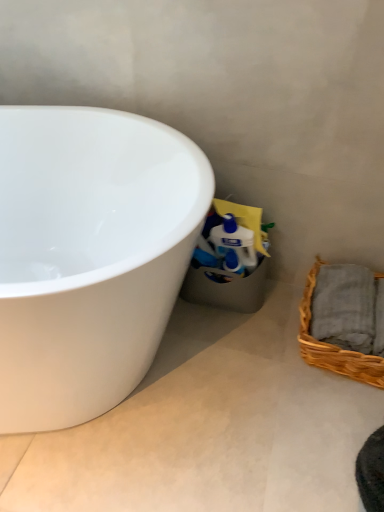
What is the approximate width of white glossy concrete at lower left?

It is 38.07 inches.

What is the approximate width of woven brown picnic basket at lower right?

11.73 inches.

The width and height of the screenshot is (384, 512). In order to click on white glossy bathtub at left in this screenshot , I will do `click(89, 255)`.

Find the location of `white glossy concrete at lower left`. white glossy concrete at lower left is located at coordinates (209, 426).

Image resolution: width=384 pixels, height=512 pixels. In order to click on picnic basket to the right of white glossy concrete at lower left in this screenshot , I will do `click(334, 345)`.

Considering the sizes of objects white glossy concrete at lower left and woven brown picnic basket at lower right in the image provided, who is bigger, white glossy concrete at lower left or woven brown picnic basket at lower right?

Bigger between the two is white glossy concrete at lower left.

Measure the distance between white glossy concrete at lower left and woven brown picnic basket at lower right.

white glossy concrete at lower left and woven brown picnic basket at lower right are 11.27 inches apart from each other.

From the image's perspective, is white glossy bathtub at left located above or below white glossy concrete at lower left?

Based on their image positions, white glossy bathtub at left is located above white glossy concrete at lower left.

Who is bigger, white glossy bathtub at left or white glossy concrete at lower left?

Bigger between the two is white glossy bathtub at left.

How many degrees apart are the facing directions of white glossy bathtub at left and white glossy concrete at lower left?

The angle between the facing direction of white glossy bathtub at left and the facing direction of white glossy concrete at lower left is 159 degrees.

Between white glossy bathtub at left and white glossy concrete at lower left, which one has more height?

white glossy bathtub at left.

How different are the orientations of white glossy concrete at lower left and white glossy bathtub at left in degrees?

There is a 159-degree angle between the facing directions of white glossy concrete at lower left and white glossy bathtub at left.

Is white glossy concrete at lower left not inside white glossy bathtub at left?

That's correct, white glossy concrete at lower left is outside of white glossy bathtub at left.

Which is more to the left, white glossy concrete at lower left or white glossy bathtub at left?

white glossy bathtub at left is more to the left.

Between white glossy bathtub at left and woven brown picnic basket at lower right, which one is positioned in front?

white glossy bathtub at left is in front.

The image size is (384, 512). I want to click on bathtub to the left of woven brown picnic basket at lower right, so tap(89, 255).

Is point (114, 343) positioned after point (309, 362)?

No.

From a real-world perspective, which is physically below, white glossy bathtub at left or woven brown picnic basket at lower right?

woven brown picnic basket at lower right is physically lower.

Is woven brown picnic basket at lower right bigger than white glossy concrete at lower left?

Actually, woven brown picnic basket at lower right might be smaller than white glossy concrete at lower left.

The width and height of the screenshot is (384, 512). I want to click on concrete on the left side of woven brown picnic basket at lower right, so click(x=209, y=426).

How many degrees apart are the facing directions of woven brown picnic basket at lower right and white glossy concrete at lower left?

The angular difference between woven brown picnic basket at lower right and white glossy concrete at lower left is 88 degrees.

Is woven brown picnic basket at lower right completely or partially outside of white glossy concrete at lower left?

Yes.

Measure the distance between woven brown picnic basket at lower right and white glossy bathtub at left.

woven brown picnic basket at lower right and white glossy bathtub at left are 24.65 inches apart.

You are a GUI agent. You are given a task and a screenshot of the screen. Output one action in this format:
    pyautogui.click(x=<x>, y=<y>)
    Task: Click on the picnic basket that appears behind the white glossy bathtub at left
    Image resolution: width=384 pixels, height=512 pixels.
    Given the screenshot: What is the action you would take?
    pyautogui.click(x=334, y=345)

Is woven brown picnic basket at lower right completely or partially outside of white glossy bathtub at left?

Yes, woven brown picnic basket at lower right is not within white glossy bathtub at left.

Is woven brown picnic basket at lower right oriented towards white glossy bathtub at left?

Yes, woven brown picnic basket at lower right is turned towards white glossy bathtub at left.

Locate an element on the screen. The width and height of the screenshot is (384, 512). picnic basket on the right side of white glossy concrete at lower left is located at coordinates (334, 345).

The height and width of the screenshot is (512, 384). Find the location of `bathtub that appears above the white glossy concrete at lower left (from the image's perspective)`. bathtub that appears above the white glossy concrete at lower left (from the image's perspective) is located at coordinates (89, 255).

Which object lies nearer to the anchor point woven brown picnic basket at lower right, white glossy concrete at lower left or white glossy bathtub at left?

Among the two, white glossy concrete at lower left is located nearer to woven brown picnic basket at lower right.

Which object lies nearer to the anchor point white glossy concrete at lower left, white glossy bathtub at left or woven brown picnic basket at lower right?

woven brown picnic basket at lower right is positioned closer to the anchor white glossy concrete at lower left.

Considering their positions, is white glossy concrete at lower left positioned further to white glossy bathtub at left than woven brown picnic basket at lower right?

Among the two, woven brown picnic basket at lower right is located further to white glossy bathtub at left.

Which object lies further to the anchor point white glossy concrete at lower left, woven brown picnic basket at lower right or white glossy bathtub at left?

white glossy bathtub at left.

Looking at the image, which one is located closer to white glossy bathtub at left, woven brown picnic basket at lower right or white glossy concrete at lower left?

The object closer to white glossy bathtub at left is white glossy concrete at lower left.

Looking at the image, which one is located closer to woven brown picnic basket at lower right, white glossy bathtub at left or white glossy concrete at lower left?

Among the two, white glossy concrete at lower left is located nearer to woven brown picnic basket at lower right.

The width and height of the screenshot is (384, 512). I want to click on concrete between white glossy bathtub at left and woven brown picnic basket at lower right, so click(x=209, y=426).